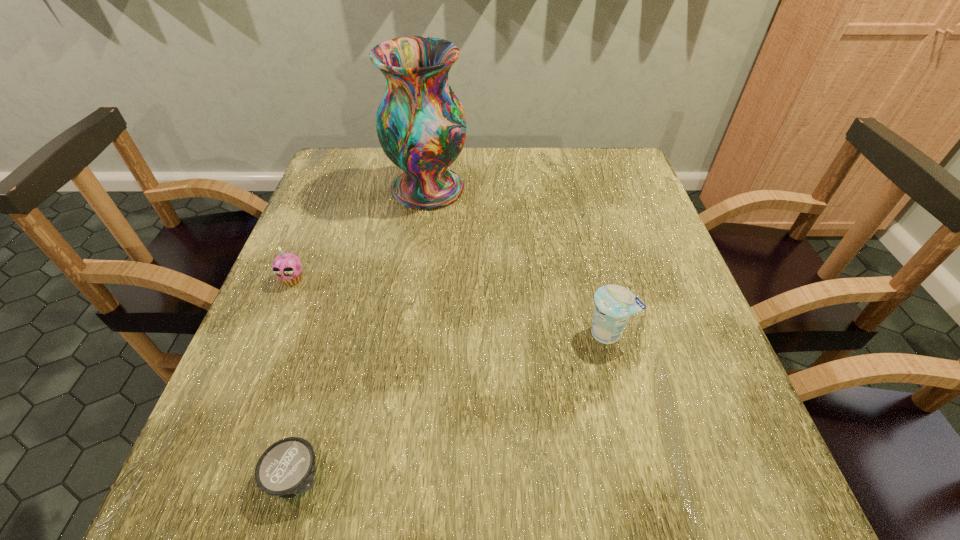
Identify the location of the farthest object. The image size is (960, 540). (421, 125).

Locate an element on the screen. the tallest object is located at coordinates (421, 125).

This screenshot has width=960, height=540. What are the coordinates of `the rightmost object` in the screenshot? It's located at (614, 304).

You are a GUI agent. You are given a task and a screenshot of the screen. Output one action in this format:
    pyautogui.click(x=<x>, y=<y>)
    Task: Click on the taller yogurt
    
    Given the screenshot: What is the action you would take?
    pyautogui.click(x=614, y=304)

What are the coordinates of `the third nearest object` in the screenshot? It's located at (287, 267).

Where is `cupcake`? This screenshot has width=960, height=540. cupcake is located at coordinates (287, 267).

You are a GUI agent. You are given a task and a screenshot of the screen. Output one action in this format:
    pyautogui.click(x=<x>, y=<y>)
    Task: Click on the nearest object
    
    Given the screenshot: What is the action you would take?
    pyautogui.click(x=286, y=469)

Where is `the shorter yogurt`? This screenshot has height=540, width=960. the shorter yogurt is located at coordinates (286, 469).

Locate an element on the screen. The height and width of the screenshot is (540, 960). vacant region located on the right of the vase is located at coordinates (605, 189).

Where is `vacant space situated on the front of the taller yogurt`? The image size is (960, 540). vacant space situated on the front of the taller yogurt is located at coordinates (626, 403).